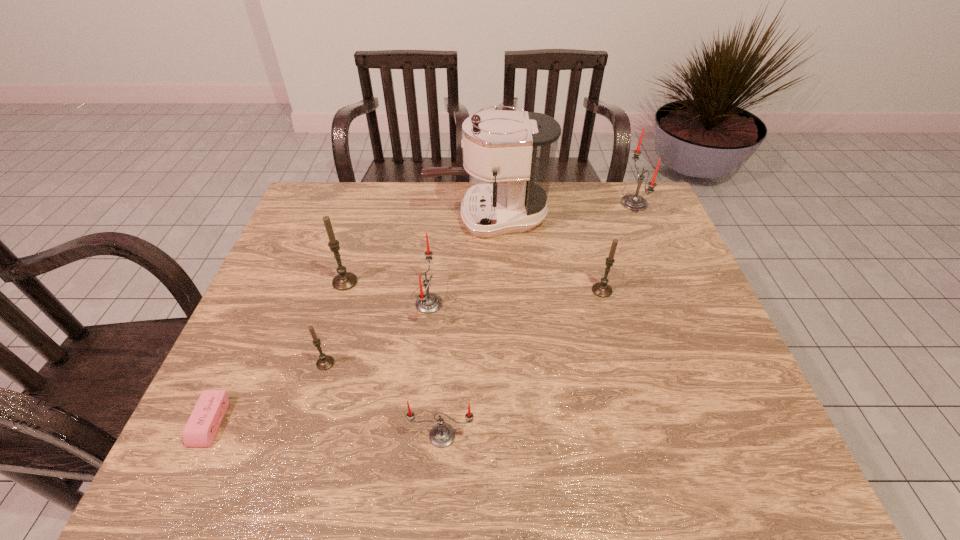
The width and height of the screenshot is (960, 540). I want to click on free space located 0.200m on the back of the biggest gray candle, so click(361, 228).

Where is `vacant point located 0.250m on the back of the second biggest gray candle`? This screenshot has height=540, width=960. vacant point located 0.250m on the back of the second biggest gray candle is located at coordinates (585, 226).

This screenshot has width=960, height=540. Find the location of `free space located on the front-facing side of the second nearest red candle`. free space located on the front-facing side of the second nearest red candle is located at coordinates (489, 303).

This screenshot has height=540, width=960. I want to click on vacant space located on the front of the nearest gray candle, so click(x=310, y=415).

In order to click on vacant space located on the back of the leftmost object in this screenshot , I will do `click(260, 314)`.

Where is `coffee maker positioned at the far edge`? This screenshot has height=540, width=960. coffee maker positioned at the far edge is located at coordinates (518, 147).

Locate an element on the screen. The width and height of the screenshot is (960, 540). candle located at the far edge is located at coordinates (632, 202).

The image size is (960, 540). I want to click on candle that is at the near edge, so click(x=442, y=435).

Where is `eraser that is at the near edge`? This screenshot has height=540, width=960. eraser that is at the near edge is located at coordinates (201, 428).

Locate an element on the screen. object present at the left edge is located at coordinates (201, 428).